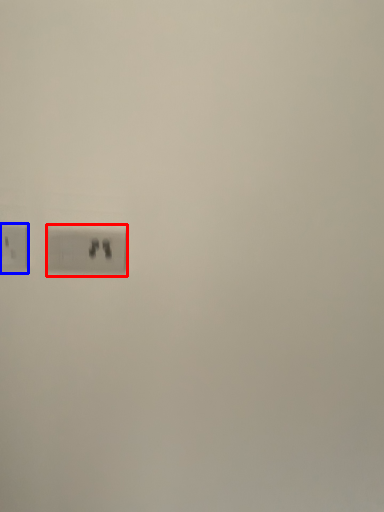
Question: Which point is closer to the camera, power plugs and sockets (highlighted by a red box) or power plugs and sockets (highlighted by a blue box)?

Choices:
 (A) power plugs and sockets
 (B) power plugs and sockets

Answer: (B)